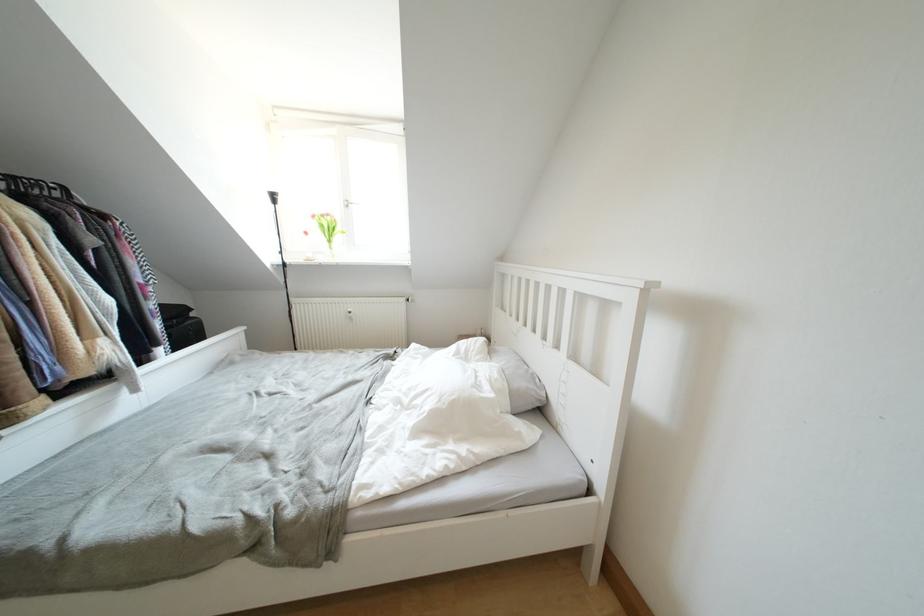
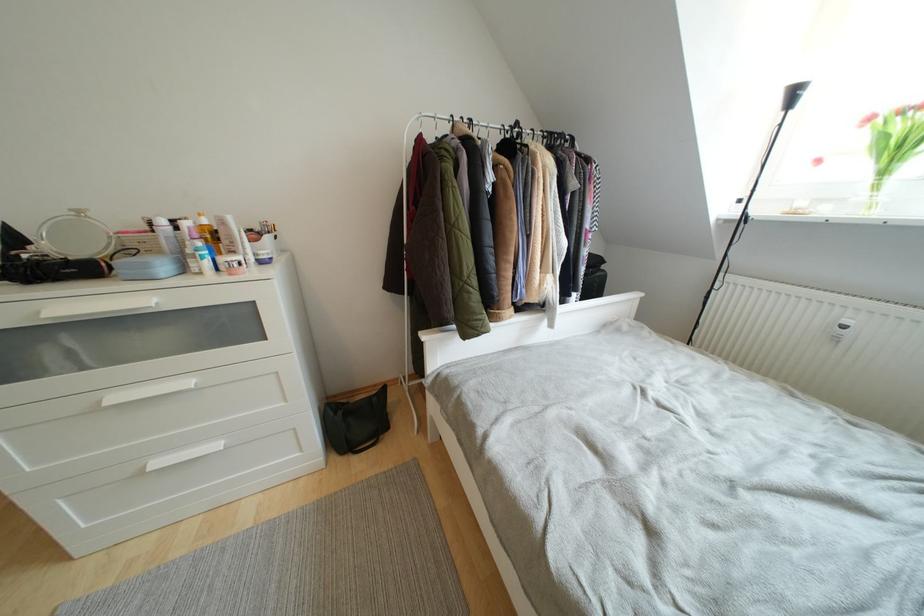
The point at (334, 246) is marked in the first image. Where is the corresponding point in the second image?

(890, 176)